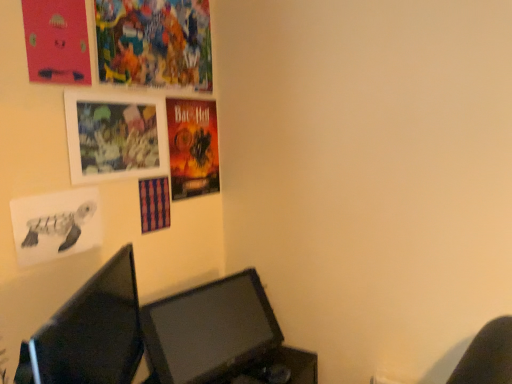
Question: From the image's perspective, is vibrant paper poster at upper left, which is the third poster page from bottom to top, located above or below shiny paper poster at upper center?

Choices:
 (A) below
 (B) above

Answer: (B)

Question: Looking at their shapes, would you say vibrant paper poster at upper left, the first poster page in the top-to-bottom sequence, is wider or thinner than shiny paper poster at upper center?

Choices:
 (A) thin
 (B) wide

Answer: (A)

Question: Which of these objects is positioned closest to the matte black monitor at lower left, which is the 1th computer monitor in front-to-back order?

Choices:
 (A) vibrant paper poster at upper left, which is the third poster page from bottom to top
 (B) shiny paper poster at upper center
 (C) black paper turtle at lower left, which ranks as the 3th poster page in top-to-bottom order
 (D) matte plastic picture frame at upper left
 (E) matte pink poster at upper left, which ranks as the 2th poster page in top-to-bottom order

Answer: (C)

Question: Which object is the farthest from the matte plastic picture frame at upper left?

Choices:
 (A) matte black monitor at lower center, marked as the 2th computer monitor in a front-to-back arrangement
 (B) matte black monitor at lower left, which is the 1th computer monitor in front-to-back order
 (C) black paper turtle at lower left, which ranks as the 3th poster page in top-to-bottom order
 (D) matte pink poster at upper left, which ranks as the 2th poster page in top-to-bottom order
 (E) shiny paper poster at upper center

Answer: (A)